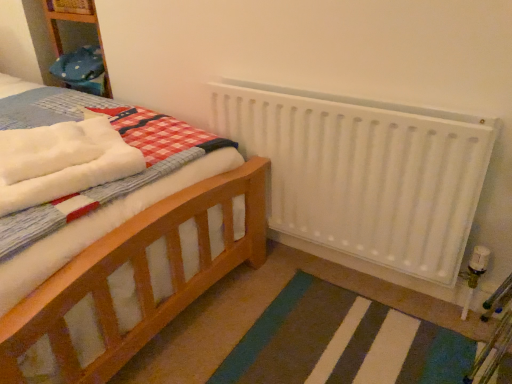
Identify the location of free space in front of white matte radiator at upper right. (339, 331).